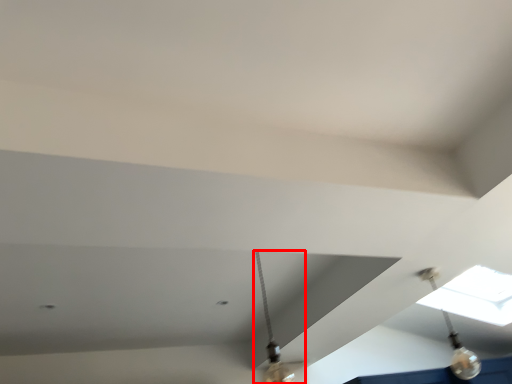
Question: In this image, where is lamp (annotated by the red box) located relative to light fixture?

Choices:
 (A) left
 (B) right

Answer: (A)